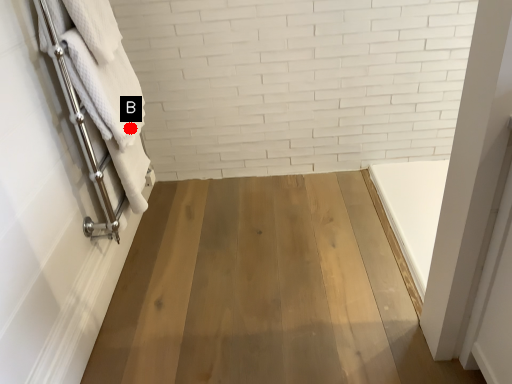
Question: Two points are circled on the image, labeled by A and B beside each circle. Which point is further to the camera?

Choices:
 (A) A is further
 (B) B is further

Answer: (B)